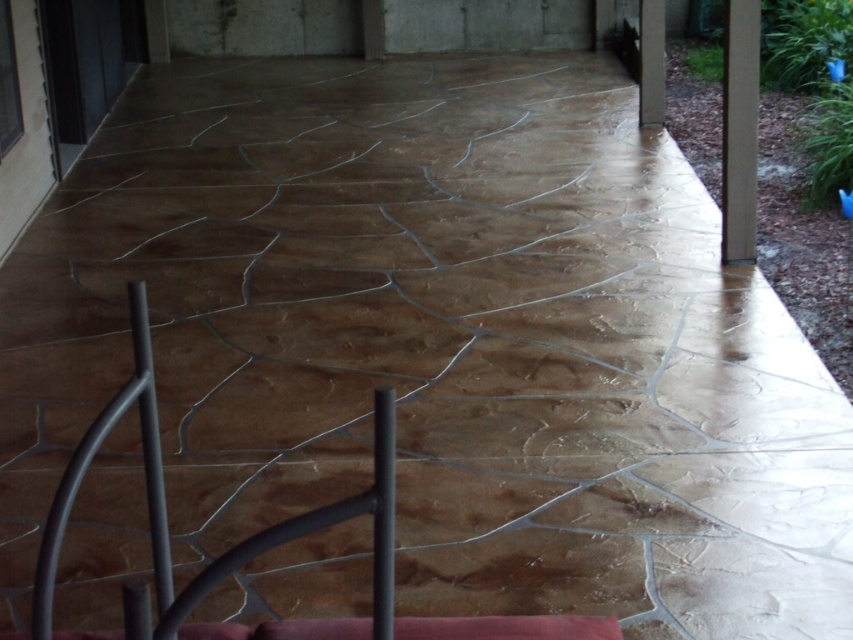
Question: Which object is closer to the camera taking this photo?

Choices:
 (A) smooth concrete pillar at upper right
 (B) brown wood pillar at upper right

Answer: (B)

Question: Is brown wood pillar at upper right thinner than smooth concrete pillar at upper right?

Choices:
 (A) no
 (B) yes

Answer: (B)

Question: Is brown wood pillar at upper right to the right of smooth concrete pillar at upper right from the viewer's perspective?

Choices:
 (A) no
 (B) yes

Answer: (B)

Question: Which point is closer to the camera taking this photo?

Choices:
 (A) (660, 40)
 (B) (747, 220)

Answer: (B)

Question: Which point is closer to the camera?

Choices:
 (A) click(x=663, y=106)
 (B) click(x=738, y=241)

Answer: (B)

Question: Does brown wood pillar at upper right have a smaller size compared to smooth concrete pillar at upper right?

Choices:
 (A) no
 (B) yes

Answer: (A)